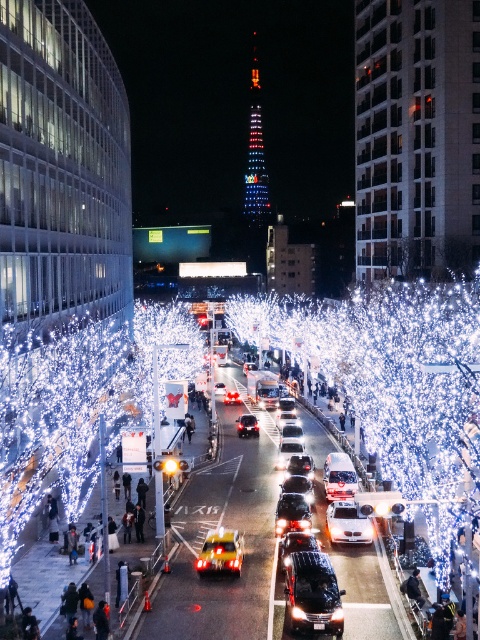
Question: Can you confirm if shiny gold car at center is smaller than white glossy car at center?

Choices:
 (A) yes
 (B) no

Answer: (A)

Question: Is illuminated wire at center closer to the viewer compared to glossy metallic car at center?

Choices:
 (A) yes
 (B) no

Answer: (A)

Question: Is illuminated wire at center closer to camera compared to white glossy car at center?

Choices:
 (A) yes
 (B) no

Answer: (A)

Question: Among these objects, which one is farthest from the camera?

Choices:
 (A) white glossy car at center
 (B) glossy metallic car at center

Answer: (B)

Question: Which point is closer to the camera?

Choices:
 (A) glossy metallic car at center
 (B) shiny black car at center

Answer: (B)

Question: Which object is positioned closest to the shiny black car at center?

Choices:
 (A) white glossy car at center
 (B) glossy metallic car at center
 (C) illuminated wire at center
 (D) shiny gold car at center

Answer: (D)